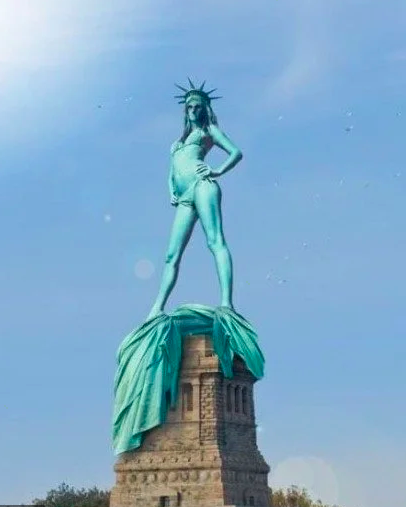
I want to click on green robe, so pyautogui.click(x=157, y=353), pyautogui.click(x=239, y=339).